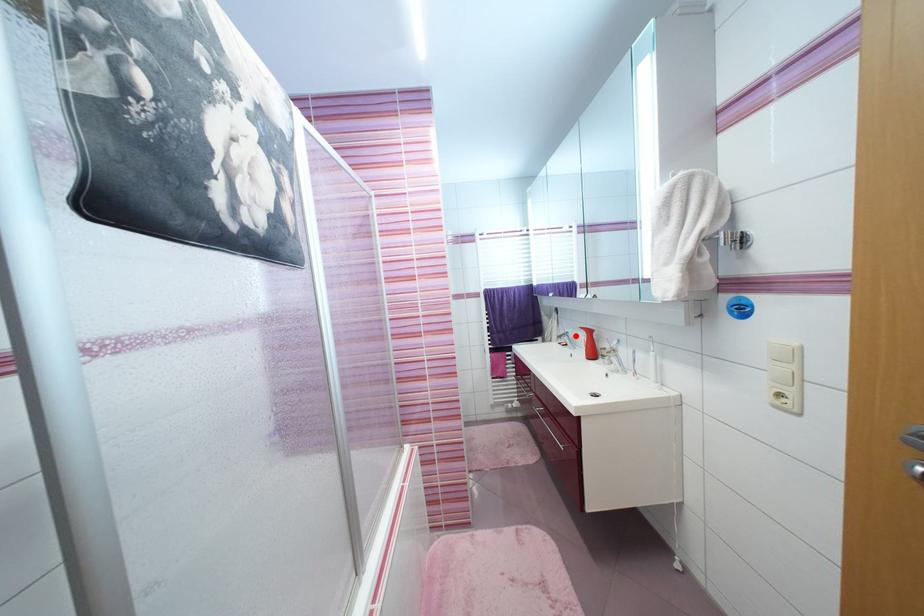
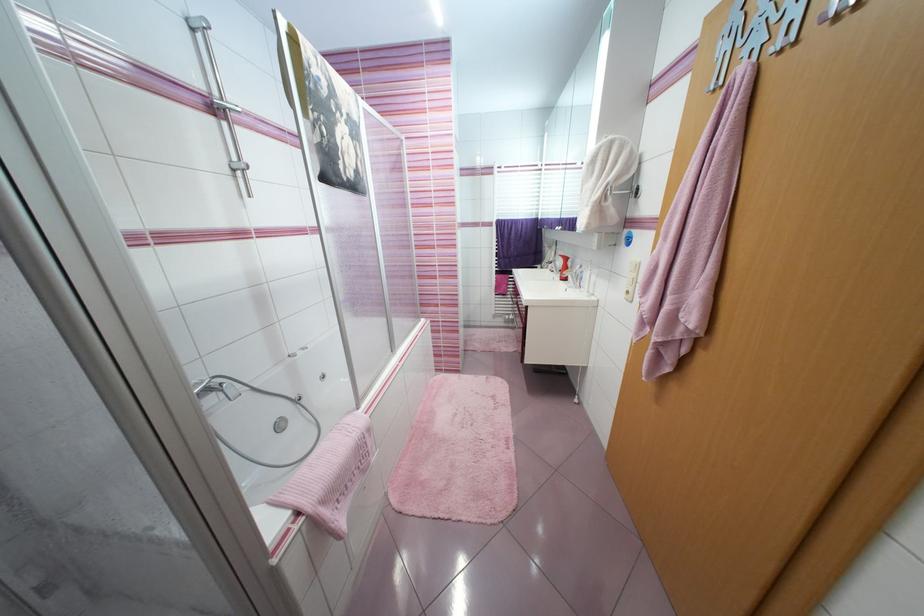
Question: I am providing you with two images of the same scene from different viewpoints. Given a red point in image1, look at the same physical point in image2. Is it:

Choices:
 (A) Closer to the viewpoint
 (B) Farther from the viewpoint

Answer: (A)